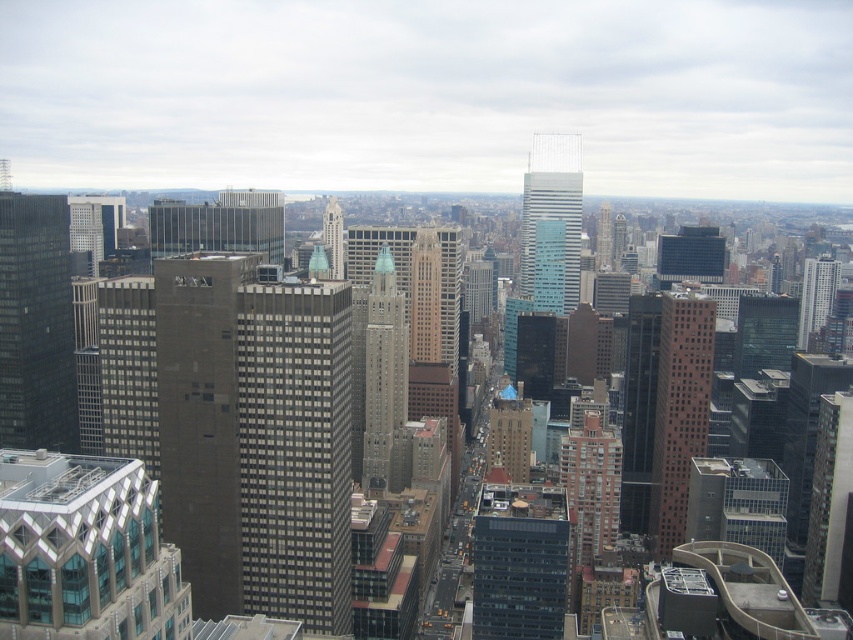
Does dark gray concrete skyscraper at center appear over gray glass skyscraper at center?

No, dark gray concrete skyscraper at center is not above gray glass skyscraper at center.

Is dark gray concrete skyscraper at center shorter than gray glass skyscraper at center?

Incorrect, dark gray concrete skyscraper at center's height does not fall short of gray glass skyscraper at center's.

Is point (166, 323) behind point (323, 209)?

No, (166, 323) is closer to viewer.

You are a GUI agent. You are given a task and a screenshot of the screen. Output one action in this format:
    pyautogui.click(x=<x>, y=<y>)
    Task: Click on the dark gray concrete skyscraper at center
    The image size is (853, 640).
    Given the screenshot: What is the action you would take?
    pyautogui.click(x=254, y=438)

Can you confirm if teal glass skyscraper at center is shorter than white glass building at upper right?

No.

The width and height of the screenshot is (853, 640). In order to click on teal glass skyscraper at center in this screenshot , I will do `click(553, 204)`.

Between point (569, 307) and point (341, 256), which one is positioned behind?

Point (569, 307)

How distant is teal glass skyscraper at center from gray glass skyscraper at center?

They are 137.12 meters apart.

Is point (563, 186) behind point (323, 241)?

Yes, point (563, 186) is farther from viewer.

In order to click on teal glass skyscraper at center in this screenshot , I will do `click(553, 204)`.